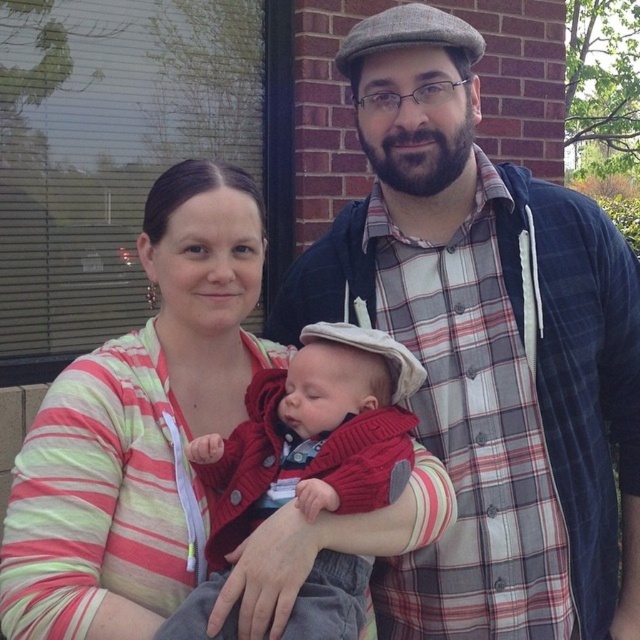
Question: Does plaid shirt at center have a smaller size compared to striped fabric at center?

Choices:
 (A) no
 (B) yes

Answer: (A)

Question: Which point is closer to the camera taking this photo?

Choices:
 (A) (480, 428)
 (B) (189, 337)

Answer: (B)

Question: Among these objects, which one is nearest to the camera?

Choices:
 (A) plaid shirt at center
 (B) knitted red sweater at center

Answer: (B)

Question: Does plaid shirt at center appear on the right side of striped fabric at center?

Choices:
 (A) no
 (B) yes

Answer: (B)

Question: Is plaid shirt at center positioned in front of knitted red sweater at center?

Choices:
 (A) no
 (B) yes

Answer: (A)

Question: Which of these objects is positioned closest to the knitted red sweater at center?

Choices:
 (A) striped fabric at center
 (B) plaid shirt at center

Answer: (A)